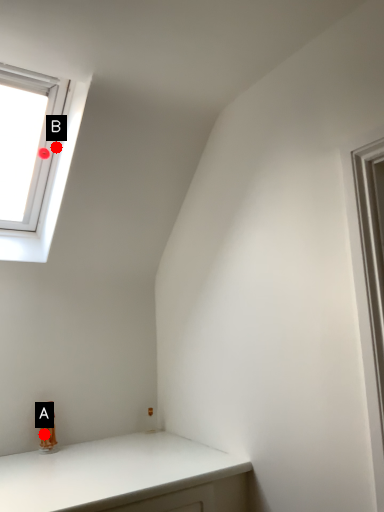
Question: Two points are circled on the image, labeled by A and B beside each circle. Among these points, which one is nearest to the camera?

Choices:
 (A) A is closer
 (B) B is closer

Answer: (A)